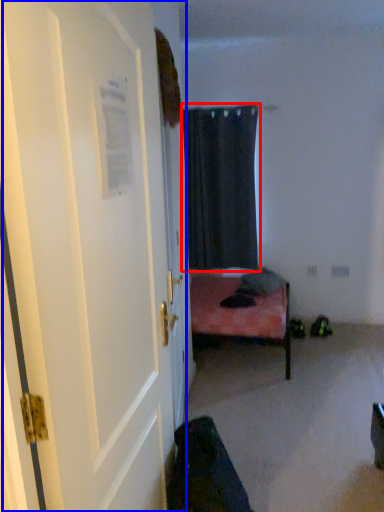
Question: Which object is closer to the camera taking this photo, curtain (highlighted by a red box) or door (highlighted by a blue box)?

Choices:
 (A) curtain
 (B) door

Answer: (B)